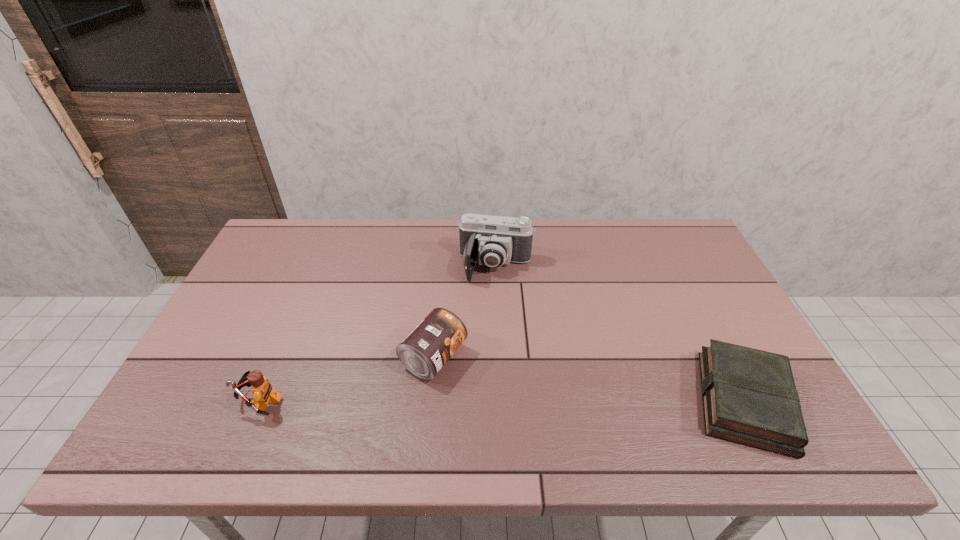
Locate an element on the screen. The width and height of the screenshot is (960, 540). free region located 0.050m at the front of the tallest object with an open lens cover is located at coordinates (489, 296).

The image size is (960, 540). I want to click on free spot located 0.180m at the front of the tallest object with an open lens cover, so click(482, 329).

Image resolution: width=960 pixels, height=540 pixels. I want to click on free spot located at the front of the tallest object with an open lens cover, so click(x=481, y=332).

Where is `vacant space located 0.110m on the front label of the can`? Image resolution: width=960 pixels, height=540 pixels. vacant space located 0.110m on the front label of the can is located at coordinates (500, 393).

I want to click on vacant area located 0.140m on the front label of the can, so pos(511,398).

You are a GUI agent. You are given a task and a screenshot of the screen. Output one action in this format:
    pyautogui.click(x=<x>, y=<y>)
    Task: Click on the free point located 0.170m on the front label of the can
    This screenshot has width=960, height=540.
    Given the screenshot: What is the action you would take?
    pyautogui.click(x=522, y=404)

You are a GUI agent. You are given a task and a screenshot of the screen. Output one action in this format:
    pyautogui.click(x=<x>, y=<y>)
    Task: Click on the object at the far edge
    
    Given the screenshot: What is the action you would take?
    pyautogui.click(x=492, y=241)

Identify the location of Lego situated at the near edge. The height and width of the screenshot is (540, 960). (262, 390).

At what (x,y) coordinates should I click in order to perform the action: click on book at the near edge. Please return your answer as a coordinate pair (x, y). Looking at the image, I should click on (749, 396).

At what (x,y) coordinates should I click in order to perform the action: click on can situated at the near edge. Please return your answer as a coordinate pair (x, y). Looking at the image, I should click on click(430, 345).